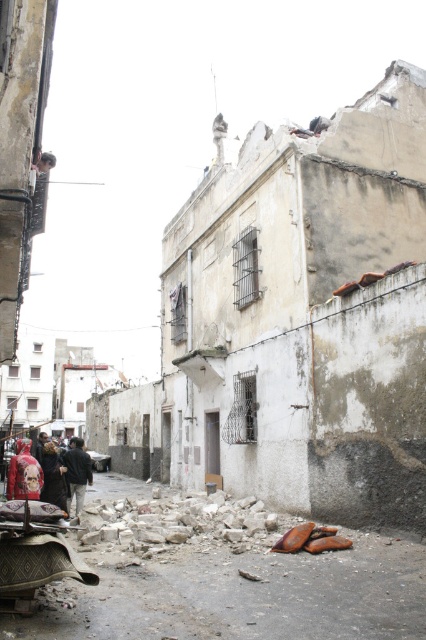
From the picture: Is rusty metal shoes at lower center thinner than rustic wood cart at lower left?

In fact, rusty metal shoes at lower center might be wider than rustic wood cart at lower left.

You are a GUI agent. You are given a task and a screenshot of the screen. Output one action in this format:
    pyautogui.click(x=<x>, y=<y>)
    Task: Click on the rusty metal shoes at lower center
    This screenshot has height=640, width=426.
    Given the screenshot: What is the action you would take?
    pyautogui.click(x=236, y=588)

In order to click on rusty metal shoes at lower center in this screenshot , I will do `click(236, 588)`.

Is rusty metal shoes at lower center above dark gray jacket at lower left?

No.

Between point (270, 632) and point (91, 468), which one is positioned in front?

Positioned in front is point (270, 632).

In order to click on rusty metal shoes at lower center in this screenshot , I will do `click(236, 588)`.

This screenshot has width=426, height=640. Find the location of `rusty metal shoes at lower center`. rusty metal shoes at lower center is located at coordinates (236, 588).

The height and width of the screenshot is (640, 426). What do you see at coordinates (34, 561) in the screenshot?
I see `rustic wood cart at lower left` at bounding box center [34, 561].

Based on the photo, measure the distance between rustic wood cart at lower left and camera.

rustic wood cart at lower left is 6.88 meters from camera.

I want to click on rustic wood cart at lower left, so click(x=34, y=561).